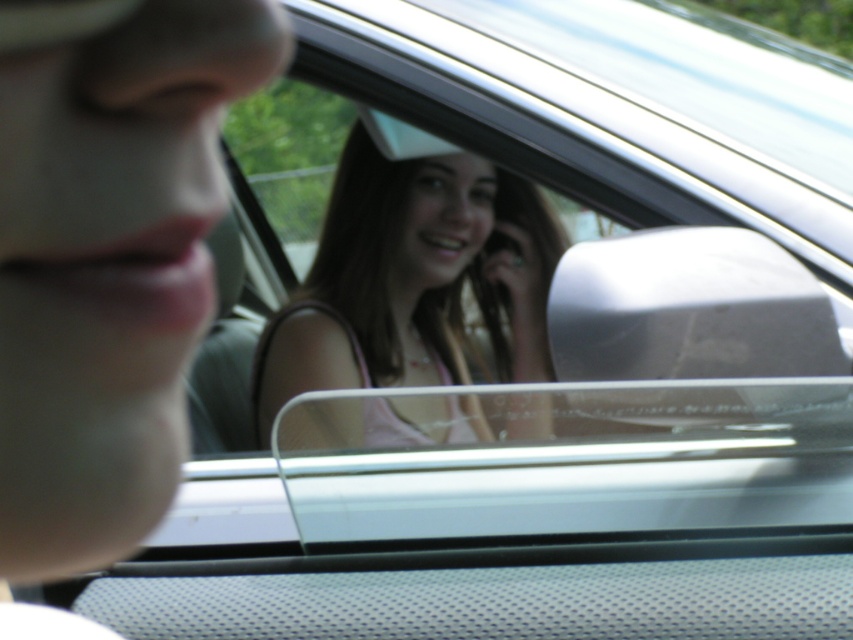
Is matte skin at left to the left of pink fabric at center from the viewer's perspective?

Correct, you'll find matte skin at left to the left of pink fabric at center.

Which is behind, point (138, 38) or point (341, 404)?

Point (341, 404)

This screenshot has width=853, height=640. Identify the location of matte skin at left. (108, 257).